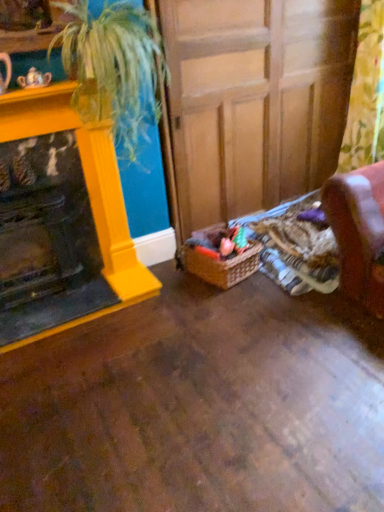
What do you see at coordinates (251, 102) in the screenshot? The width and height of the screenshot is (384, 512). I see `wooden at center` at bounding box center [251, 102].

Measure the distance between point (190, 193) and camera.

Point (190, 193) is 2.76 meters away from camera.

The image size is (384, 512). I want to click on floral fabric curtain at right, so click(x=366, y=93).

Where is `woven brown basket at lower center`? The width and height of the screenshot is (384, 512). woven brown basket at lower center is located at coordinates (221, 265).

From the picture: Which object is further away from the camera, floral fabric curtain at right or woven brown basket at lower center?

woven brown basket at lower center is more distant.

Looking at this image, is floral fabric curtain at right turned away from woven brown basket at lower center?

floral fabric curtain at right is not turned away from woven brown basket at lower center.

Is floral fabric curtain at right thinner than woven brown basket at lower center?

Indeed, floral fabric curtain at right has a lesser width compared to woven brown basket at lower center.

Could woven brown basket at lower center be considered to be inside wooden at center?

No, woven brown basket at lower center is not a part of wooden at center.

Locate an element on the screen. The image size is (384, 512). basket that appears on the left of wooden at center is located at coordinates (221, 265).

Considering the relative positions of wooden at center and woven brown basket at lower center in the image provided, is wooden at center to the left or to the right of woven brown basket at lower center?

wooden at center is to the right of woven brown basket at lower center.

From the image's perspective, between wooden at center and woven brown basket at lower center, which one is located above?

wooden at center appears higher in the image.

Considering the positions of points (321, 129) and (28, 255), is point (321, 129) closer to camera compared to point (28, 255)?

No.

Is the depth of wooden at center greater than that of matte yellow fireplace at left?

Yes, wooden at center is behind matte yellow fireplace at left.

In the scene shown: Is there a large distance between wooden at center and matte yellow fireplace at left?

No, wooden at center is not far from matte yellow fireplace at left.

Who is bigger, wooden at center or matte yellow fireplace at left?

wooden at center.

Considering the relative sizes of green leafy plant at upper left and floral fabric curtain at right in the image provided, is green leafy plant at upper left thinner than floral fabric curtain at right?

No.

Between green leafy plant at upper left and floral fabric curtain at right, which one has larger size?

Bigger between the two is green leafy plant at upper left.

Is green leafy plant at upper left looking in the opposite direction of floral fabric curtain at right?

No, green leafy plant at upper left is not facing the opposite direction of floral fabric curtain at right.

From a real-world perspective, is green leafy plant at upper left on top of floral fabric curtain at right?

Indeed, from a real-world perspective, green leafy plant at upper left stands above floral fabric curtain at right.

Which point is more forward, (358, 9) or (359, 112)?

Point (358, 9)

Is floral fabric curtain at right a part of wooden at center?

No, floral fabric curtain at right is not inside wooden at center.

Considering the sizes of objects wooden at center and floral fabric curtain at right in the image provided, who is wider, wooden at center or floral fabric curtain at right?

wooden at center is wider.

In the scene shown: Is wooden at center closer to the viewer compared to floral fabric curtain at right?

No, wooden at center is further to the viewer.

Can we say green leafy plant at upper left lies outside matte yellow fireplace at left?

That's correct, green leafy plant at upper left is outside of matte yellow fireplace at left.

Is green leafy plant at upper left closer to the viewer compared to matte yellow fireplace at left?

Yes, green leafy plant at upper left is closer to the camera.

Which of these two, floral fabric curtain at right or green leafy plant at upper left, is wider?

green leafy plant at upper left is wider.

From the image's perspective, would you say floral fabric curtain at right is positioned over green leafy plant at upper left?

Yes, from the image's perspective, floral fabric curtain at right is over green leafy plant at upper left.

From a real-world perspective, is floral fabric curtain at right positioned above or below green leafy plant at upper left?

Clearly, from a real-world perspective, floral fabric curtain at right is below green leafy plant at upper left.

Identify the location of basket behind the floral fabric curtain at right. The image size is (384, 512). (221, 265).

This screenshot has width=384, height=512. In order to click on basket below the wooden at center (from a real-world perspective) in this screenshot , I will do `click(221, 265)`.

Considering their positions, is green leafy plant at upper left positioned closer to floral fabric curtain at right than matte yellow fireplace at left?

green leafy plant at upper left is positioned closer to the anchor floral fabric curtain at right.

Estimate the real-world distances between objects in this image. Which object is closer to woven brown basket at lower center, floral fabric curtain at right or green leafy plant at upper left?

green leafy plant at upper left.

From the image, which object appears to be farther from floral fabric curtain at right, wooden at center or woven brown basket at lower center?

woven brown basket at lower center.

From the image, which object appears to be farther from matte yellow fireplace at left, wooden at center or green leafy plant at upper left?

wooden at center is further to matte yellow fireplace at left.

From the image, which object appears to be nearer to green leafy plant at upper left, floral fabric curtain at right or matte yellow fireplace at left?

Based on the image, matte yellow fireplace at left appears to be nearer to green leafy plant at upper left.

Based on their spatial positions, is woven brown basket at lower center or floral fabric curtain at right further from green leafy plant at upper left?

floral fabric curtain at right lies further to green leafy plant at upper left than the other object.

Consider the image. When comparing their distances from floral fabric curtain at right, does matte yellow fireplace at left or wooden at center seem further?

matte yellow fireplace at left lies further to floral fabric curtain at right than the other object.

Looking at the image, which one is located further to wooden at center, green leafy plant at upper left or floral fabric curtain at right?

floral fabric curtain at right is positioned further to the anchor wooden at center.

Where is `houseplant situated between matte yellow fireplace at left and floral fabric curtain at right from left to right`? This screenshot has height=512, width=384. houseplant situated between matte yellow fireplace at left and floral fabric curtain at right from left to right is located at coordinates (113, 67).

Where is `houseplant located between matte yellow fireplace at left and woven brown basket at lower center in the left-right direction`? This screenshot has height=512, width=384. houseplant located between matte yellow fireplace at left and woven brown basket at lower center in the left-right direction is located at coordinates (113, 67).

Locate an element on the screen. The width and height of the screenshot is (384, 512). curtain between wooden at center and woven brown basket at lower center vertically is located at coordinates (366, 93).

Locate an element on the screen. The height and width of the screenshot is (512, 384). houseplant that lies between wooden at center and woven brown basket at lower center from top to bottom is located at coordinates coord(113,67).